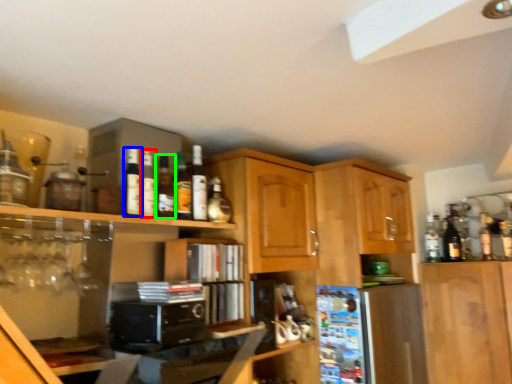
Question: Which object is positioned closest to bottle (highlighted by a red box)? Select from bottle (highlighted by a blue box) and bottle (highlighted by a green box).

Choices:
 (A) bottle
 (B) bottle

Answer: (A)